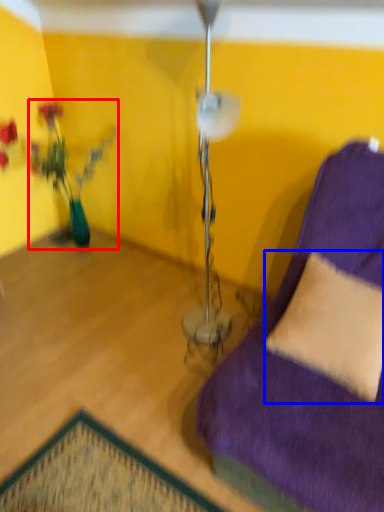
Question: Among these objects, which one is nearest to the camera, houseplant (highlighted by a red box) or pillow (highlighted by a blue box)?

Choices:
 (A) houseplant
 (B) pillow

Answer: (B)